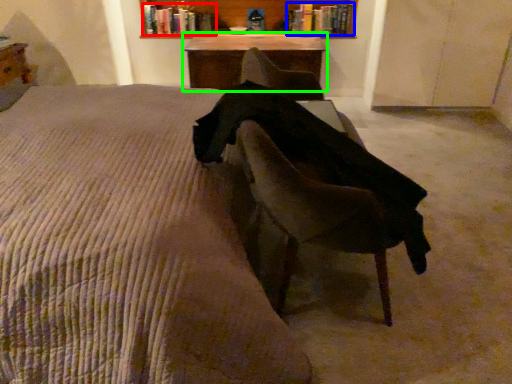
Question: Which is nearer to the book (highlighted by a red box)? book (highlighted by a blue box) or table (highlighted by a green box).

Choices:
 (A) book
 (B) table

Answer: (B)